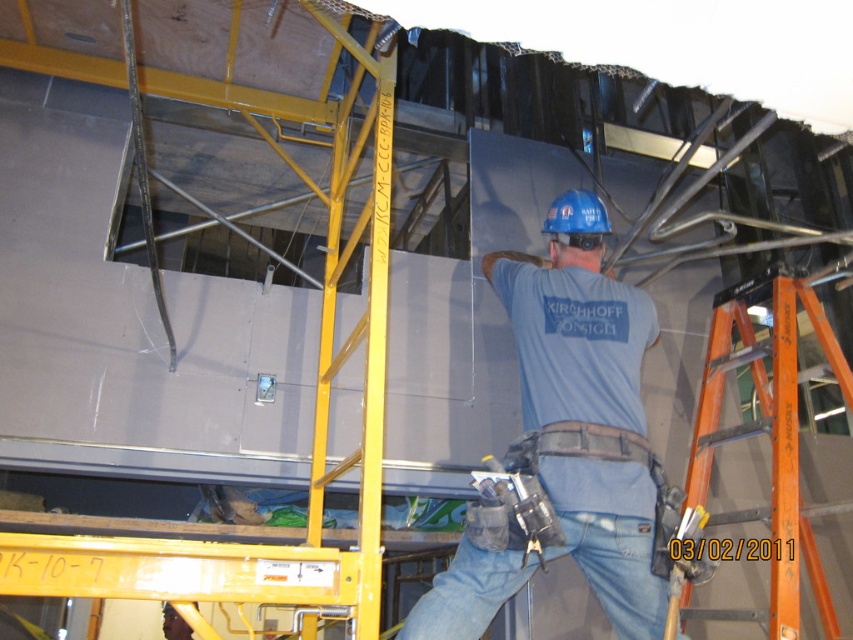
Question: Is the position of blue hard hat at center less distant than that of orange metal ladder at upper center?

Choices:
 (A) yes
 (B) no

Answer: (B)

Question: Which point is farther to the camera?

Choices:
 (A) jeans at center
 (B) blue hard hat at center
 (C) orange metal ladder at upper center
 (D) orange fiberglass ladder at right

Answer: (D)

Question: Is blue hard hat at center above jeans at center?

Choices:
 (A) no
 (B) yes

Answer: (B)

Question: Can you confirm if orange metal ladder at upper center is positioned to the left of orange fiberglass ladder at right?

Choices:
 (A) no
 (B) yes

Answer: (B)

Question: Based on their relative distances, which object is nearer to the orange fiberglass ladder at right?

Choices:
 (A) orange metal ladder at upper center
 (B) jeans at center
 (C) blue hard hat at center

Answer: (C)

Question: Which point is farther from the camera taking this photo?

Choices:
 (A) (453, 586)
 (B) (173, 77)
 (C) (691, 440)

Answer: (C)